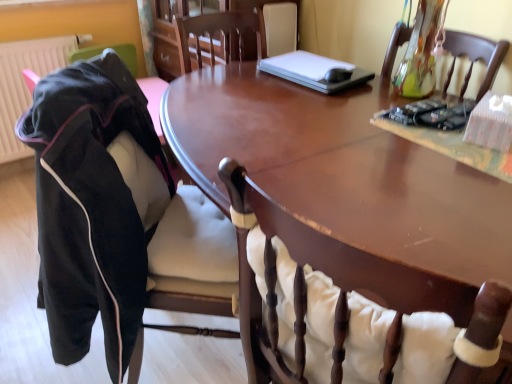
The width and height of the screenshot is (512, 384). Identify the location of vacant area on top of white plastic laptop at upper center (from a real-world perspective). (318, 66).